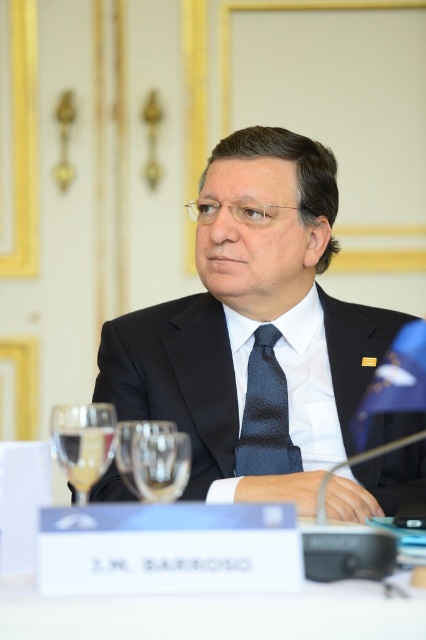
Does white satin dress shirt at center have a greater width compared to transparent glass at center?

Indeed, white satin dress shirt at center has a greater width compared to transparent glass at center.

Can you confirm if white satin dress shirt at center is positioned to the left of transparent glass at center?

No, white satin dress shirt at center is not to the left of transparent glass at center.

Who is more distant from viewer, (x=327, y=440) or (x=150, y=483)?

The point (x=327, y=440) is more distant.

Locate an element on the screen. The image size is (426, 640). white satin dress shirt at center is located at coordinates (296, 378).

Based on the photo, can you confirm if dark blue textured tie at center is positioned below transparent glass at center?

Incorrect, dark blue textured tie at center is not positioned below transparent glass at center.

Is dark blue textured tie at center to the left of transparent glass at center from the viewer's perspective?

In fact, dark blue textured tie at center is to the right of transparent glass at center.

Who is more distant from viewer, (259,420) or (166,458)?

Point (259,420)

This screenshot has width=426, height=640. I want to click on dark blue textured tie at center, so click(x=265, y=413).

Who is higher up, black silk suit at center or transparent glass at center?

Positioned higher is black silk suit at center.

Who is positioned more to the left, black silk suit at center or transparent glass at center?

transparent glass at center

Who is more forward, (249, 292) or (146, 476)?

Point (146, 476)

This screenshot has width=426, height=640. What are the coordinates of `black silk suit at center` in the screenshot? It's located at (247, 320).